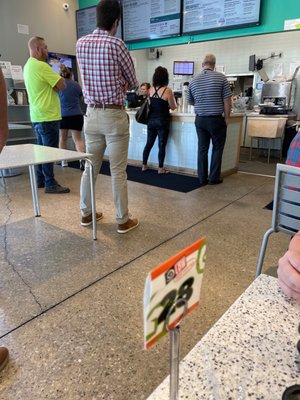
Locate an element on the screen. Image resolution: width=300 pixels, height=400 pixels. wall is located at coordinates (58, 32).